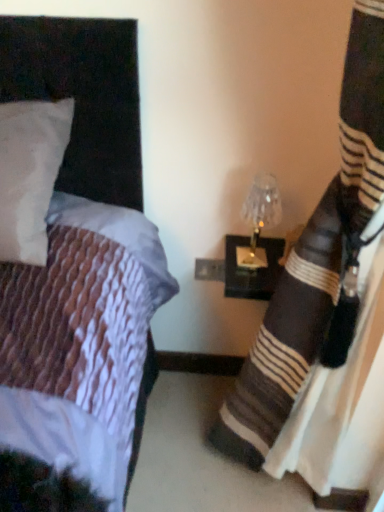
Question: Is black striped fabric at right inside or outside of translucent glass lampshade at right?

Choices:
 (A) inside
 (B) outside

Answer: (B)

Question: From a real-world perspective, is black striped fabric at right positioned above or below translucent glass lampshade at right?

Choices:
 (A) above
 (B) below

Answer: (B)

Question: From the image's perspective, relative to translucent glass lampshade at right, is black striped fabric at right above or below?

Choices:
 (A) above
 (B) below

Answer: (B)

Question: Is translucent glass lampshade at right inside or outside of black striped fabric at right?

Choices:
 (A) outside
 (B) inside

Answer: (A)

Question: Considering their positions, is translucent glass lampshade at right located in front of or behind black striped fabric at right?

Choices:
 (A) behind
 (B) front

Answer: (A)

Question: Looking at the image, does translucent glass lampshade at right seem bigger or smaller compared to black striped fabric at right?

Choices:
 (A) big
 (B) small

Answer: (B)

Question: From a real-world perspective, is translucent glass lampshade at right above or below black striped fabric at right?

Choices:
 (A) below
 (B) above

Answer: (B)